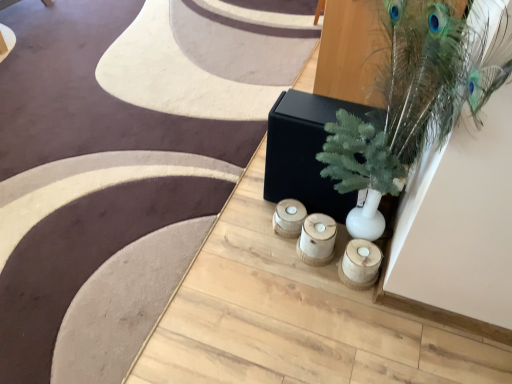
How much space does wooden candle holders at center, the first candle holder positioned from the left, occupy vertically?

wooden candle holders at center, the first candle holder positioned from the left, is 5.71 inches in height.

The width and height of the screenshot is (512, 384). What do you see at coordinates (317, 239) in the screenshot?
I see `wooden candle holders at center, which is the 2th candle holder from right to left` at bounding box center [317, 239].

Describe the element at coordinates (360, 264) in the screenshot. Image resolution: width=512 pixels, height=384 pixels. I see `wooden candle holder at lower center, positioned as the second candle holder in left-to-right order` at that location.

Locate an element on the screen. Image resolution: width=512 pixels, height=384 pixels. wooden candle holders at center, which is the 2th candle holder from right to left is located at coordinates (317, 239).

The image size is (512, 384). Identify the location of houseplant located above the wooden candle holder at lower center, acting as the 1th candle holder starting from the right (from the image's perspective). (414, 98).

How different are the orientations of wooden candle holder at lower center, positioned as the second candle holder in left-to-right order, and white matte vase at upper right in degrees?

71 degrees.

Does wooden candle holder at lower center, positioned as the second candle holder in left-to-right order, turn towards white matte vase at upper right?

Yes, wooden candle holder at lower center, positioned as the second candle holder in left-to-right order, is facing white matte vase at upper right.

Which object is wider, wooden candle holder at lower center, positioned as the second candle holder in left-to-right order, or white matte vase at upper right?

Wider between the two is white matte vase at upper right.

In terms of width, does wooden candle holders at center, the first candle holder positioned from the left, look wider or thinner when compared to wooden candle holder at lower center, acting as the 1th candle holder starting from the right?

In the image, wooden candle holders at center, the first candle holder positioned from the left, appears to be wider than wooden candle holder at lower center, acting as the 1th candle holder starting from the right.

How much distance is there between wooden candle holders at center, which is the 2th candle holder from right to left, and wooden candle holder at lower center, positioned as the second candle holder in left-to-right order?

4.51 inches.

Is the depth of wooden candle holders at center, the first candle holder positioned from the left, less than that of wooden candle holder at lower center, positioned as the second candle holder in left-to-right order?

No, wooden candle holders at center, the first candle holder positioned from the left, is behind wooden candle holder at lower center, positioned as the second candle holder in left-to-right order.

Locate an element on the screen. candle holder behind the wooden candle holder at lower center, acting as the 1th candle holder starting from the right is located at coordinates (317, 239).

Does white matte vase at upper right have a greater width compared to wooden candle holders at center, the first candle holder positioned from the left?

Correct, the width of white matte vase at upper right exceeds that of wooden candle holders at center, the first candle holder positioned from the left.

From a real-world perspective, is white matte vase at upper right under wooden candle holders at center, which is the 2th candle holder from right to left?

No, from a real-world perspective, white matte vase at upper right is not below wooden candle holders at center, which is the 2th candle holder from right to left.

From the image's perspective, which is below, white matte vase at upper right or wooden candle holders at center, which is the 2th candle holder from right to left?

wooden candle holders at center, which is the 2th candle holder from right to left.

From the picture: Is white matte vase at upper right taller or shorter than wooden candle holder at lower center, positioned as the second candle holder in left-to-right order?

white matte vase at upper right is taller than wooden candle holder at lower center, positioned as the second candle holder in left-to-right order.

Based on the photo, is wooden candle holder at lower center, acting as the 1th candle holder starting from the right, a part of white matte vase at upper right?

Yes, wooden candle holder at lower center, acting as the 1th candle holder starting from the right, is surrounded by white matte vase at upper right.

Which object is closer to the camera taking this photo, white matte vase at upper right or wooden candle holder at lower center, acting as the 1th candle holder starting from the right?

white matte vase at upper right is closer to the camera.

From a real-world perspective, is white matte vase at upper right above or below wooden candle holder at lower center, positioned as the second candle holder in left-to-right order?

In terms of real-world spatial position, white matte vase at upper right is above wooden candle holder at lower center, positioned as the second candle holder in left-to-right order.

Based on the photo, how much distance is there between wooden candle holder at lower center, positioned as the second candle holder in left-to-right order, and wooden candle holders at center, the first candle holder positioned from the left?

wooden candle holder at lower center, positioned as the second candle holder in left-to-right order, and wooden candle holders at center, the first candle holder positioned from the left, are 4.51 inches apart from each other.

Between wooden candle holder at lower center, positioned as the second candle holder in left-to-right order, and wooden candle holders at center, which is the 2th candle holder from right to left, which one appears on the right side from the viewer's perspective?

wooden candle holder at lower center, positioned as the second candle holder in left-to-right order.

Between point (366, 252) and point (324, 228), which one is positioned behind?

The point (324, 228) is farther.

From the image's perspective, is wooden candle holder at lower center, acting as the 1th candle holder starting from the right, positioned above or below wooden candle holders at center, which is the 2th candle holder from right to left?

Based on their image positions, wooden candle holder at lower center, acting as the 1th candle holder starting from the right, is located beneath wooden candle holders at center, which is the 2th candle holder from right to left.

Is wooden candle holders at center, the first candle holder positioned from the left, aimed at white matte vase at upper right?

Yes, wooden candle holders at center, the first candle holder positioned from the left, faces towards white matte vase at upper right.

How much distance is there between wooden candle holders at center, which is the 2th candle holder from right to left, and white matte vase at upper right?

A distance of 17.73 inches exists between wooden candle holders at center, which is the 2th candle holder from right to left, and white matte vase at upper right.

Looking at the image, does wooden candle holders at center, which is the 2th candle holder from right to left, seem bigger or smaller compared to white matte vase at upper right?

wooden candle holders at center, which is the 2th candle holder from right to left, is smaller than white matte vase at upper right.

Is wooden candle holders at center, which is the 2th candle holder from right to left, outside of white matte vase at upper right?

No, wooden candle holders at center, which is the 2th candle holder from right to left, is not entirely external to white matte vase at upper right.

Which candle holder is the 1st one when counting from the back of the white matte vase at upper right? Please provide its 2D coordinates.

[(360, 264)]

The image size is (512, 384). I want to click on candle holder located above the wooden candle holder at lower center, positioned as the second candle holder in left-to-right order (from the image's perspective), so click(317, 239).

Which object lies nearer to the anchor point wooden candle holder at lower center, acting as the 1th candle holder starting from the right, wooden candle holders at center, which is the 2th candle holder from right to left, or white matte vase at upper right?

wooden candle holders at center, which is the 2th candle holder from right to left.

Estimate the real-world distances between objects in this image. Which object is further from white matte vase at upper right, wooden candle holder at lower center, acting as the 1th candle holder starting from the right, or wooden candle holders at center, the first candle holder positioned from the left?

The object further to white matte vase at upper right is wooden candle holder at lower center, acting as the 1th candle holder starting from the right.

Looking at the image, which one is located further to white matte vase at upper right, wooden candle holders at center, which is the 2th candle holder from right to left, or wooden candle holder at lower center, positioned as the second candle holder in left-to-right order?

The object further to white matte vase at upper right is wooden candle holder at lower center, positioned as the second candle holder in left-to-right order.

Looking at the image, which one is located further to wooden candle holder at lower center, acting as the 1th candle holder starting from the right, white matte vase at upper right or wooden candle holders at center, which is the 2th candle holder from right to left?

Among the two, white matte vase at upper right is located further to wooden candle holder at lower center, acting as the 1th candle holder starting from the right.

Estimate the real-world distances between objects in this image. Which object is closer to wooden candle holders at center, which is the 2th candle holder from right to left, wooden candle holder at lower center, positioned as the second candle holder in left-to-right order, or white matte vase at upper right?

wooden candle holder at lower center, positioned as the second candle holder in left-to-right order, is positioned closer to the anchor wooden candle holders at center, which is the 2th candle holder from right to left.

Looking at this image, looking at the image, which one is located closer to wooden candle holders at center, the first candle holder positioned from the left, white matte vase at upper right or wooden candle holder at lower center, acting as the 1th candle holder starting from the right?

wooden candle holder at lower center, acting as the 1th candle holder starting from the right, is positioned closer to the anchor wooden candle holders at center, the first candle holder positioned from the left.

The image size is (512, 384). What are the coordinates of `candle holder between white matte vase at upper right and wooden candle holders at center, the first candle holder positioned from the left, from front to back` in the screenshot? It's located at (360, 264).